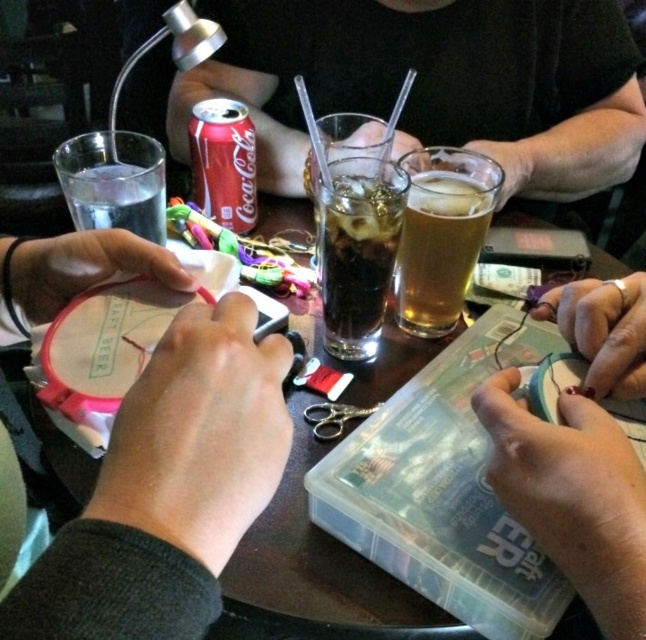
You are sitting at the table and want to place a new embroidery hoop next to the pink fabric hoop at center. The table has a coordinate system where the bottom left corner is the origin. The pink fabric hoop at center is located at point (169, 490). If you place the new hoop at point 0.7, 0.3, will it be to the left or right of the pink fabric hoop at center?

The new hoop at point 0.7, 0.3 will be to the left of the pink fabric hoop at center located at (169, 490) because the x coordinate 0.7 is less than 0.766.

You are a guest at this craft table and need to reach for an item located at point (386, 26) and another item at point (134, 168). Which item will you reach first?

The item at point (386, 26) is closer to you, so you will reach it first.